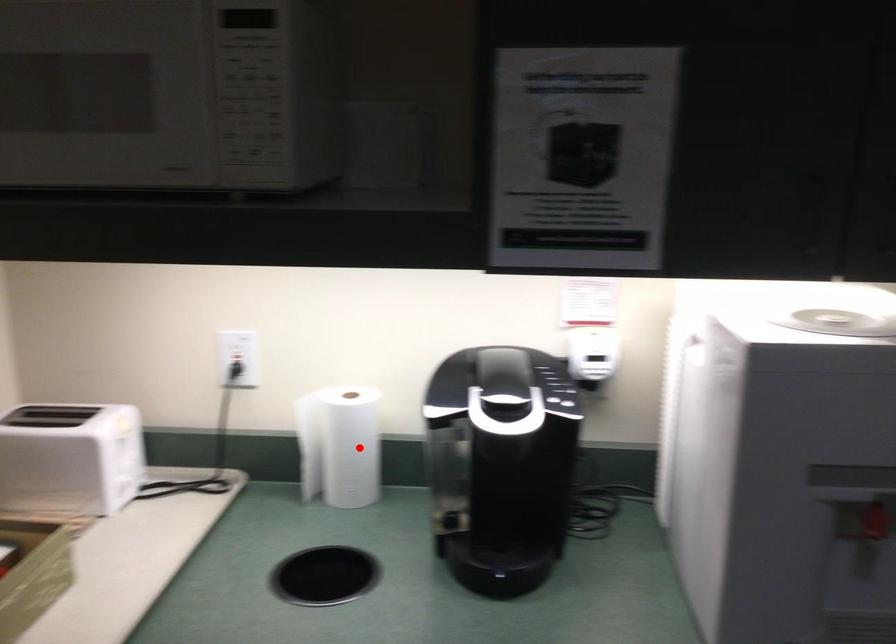
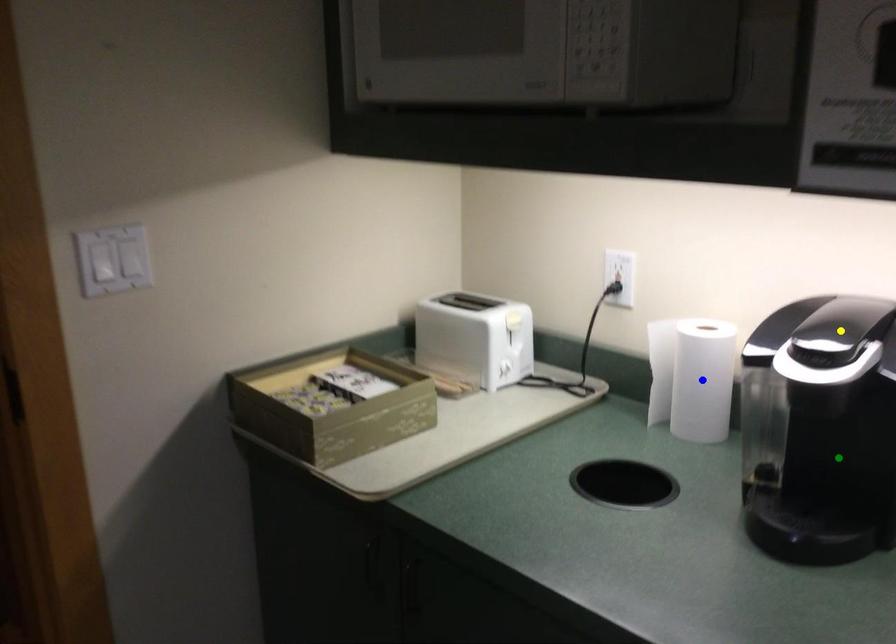
Question: I am providing you with two images of the same scene from different viewpoints. A red point is marked on the first image. You are given multiple points on the second image. Which mark in image 2 goes with the point in image 1?

Choices:
 (A) blue point
 (B) green point
 (C) yellow point

Answer: (A)